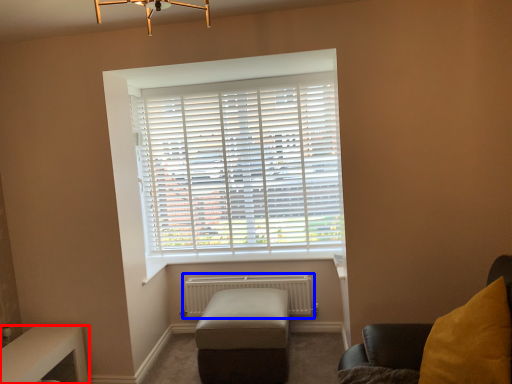
Question: Which object appears farthest to the camera in this image, table (highlighted by a red box) or radiator (highlighted by a blue box)?

Choices:
 (A) table
 (B) radiator

Answer: (B)